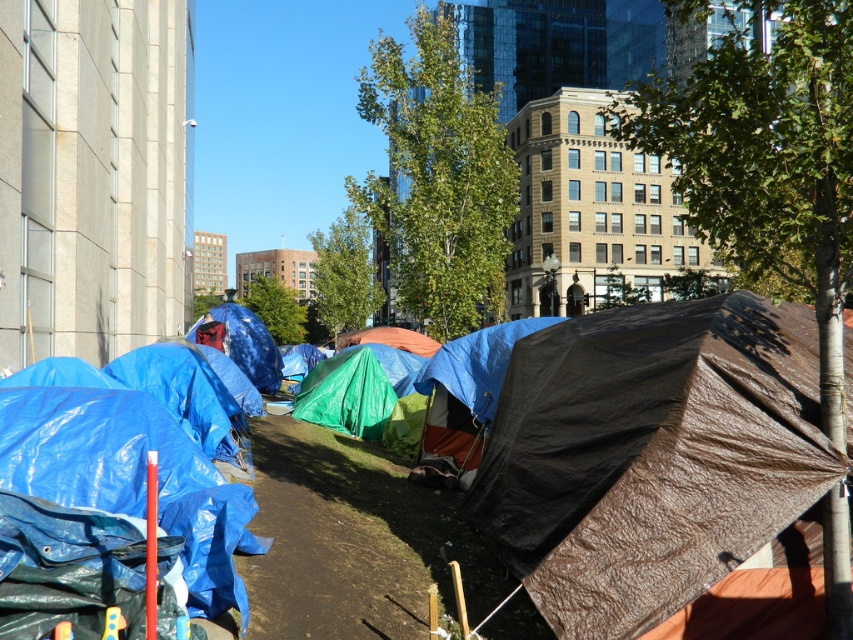
You are standing at the point marked by coordinates point (650, 456) in the image. What color of tarp is directly under your feet?

The point (650, 456) indicates the brown tarp at center, so the color of the tarp directly under your feet is brown.

You are a delivery person who needs to place a large package under one of the tarps. The package is 2 meters wide. Which tarp, the brown tarp at center or the blue tarp at center, is more likely to accommodate the package based on their widths?

The brown tarp at center might be wider than blue tarp at center, so it is more likely to accommodate the 2 meter wide package.

You are standing in the public space and want to find the brown tarp at center. According to the coordinates provided, where should you look relative to the modern building with large windows on the left?

The brown tarp at center is located at point coordinates that are further to the right and slightly higher than the modern building with large windows on the left, so you should look towards the central area of the image, to the right of the modern building.